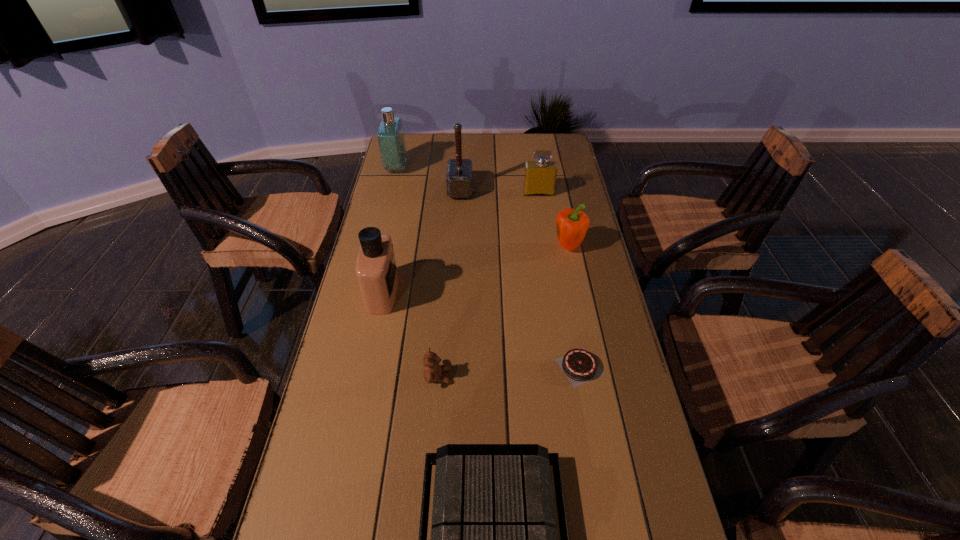
Find the location of `free space at the left edge of the desktop`. free space at the left edge of the desktop is located at coordinates (400, 172).

Where is `free spot at the right edge of the desktop`? Image resolution: width=960 pixels, height=540 pixels. free spot at the right edge of the desktop is located at coordinates (578, 175).

Locate an element on the screen. free space between the shortest object and the shortest perfume is located at coordinates (559, 280).

Locate an element on the screen. free area in between the fourth nearest object and the second nearest perfume is located at coordinates (461, 243).

Locate an element on the screen. vacant area that lies between the fifth nearest object and the shortest object is located at coordinates pyautogui.click(x=574, y=307).

At what (x,y) coordinates should I click in order to perform the action: click on vacant area that lies between the fourth nearest object and the shortest perfume. Please return your answer as a coordinate pair (x, y). The image size is (960, 540). Looking at the image, I should click on (461, 243).

Find the location of a particular element. Image resolution: width=960 pixels, height=540 pixels. free spot between the fourth farthest object and the fifth farthest object is located at coordinates (475, 270).

Locate an element on the screen. This screenshot has width=960, height=540. free point between the farthest object and the fifth farthest object is located at coordinates (390, 231).

This screenshot has width=960, height=540. I want to click on free space between the teddy bear and the second farthest perfume, so click(489, 285).

This screenshot has height=540, width=960. Identify the location of unoccupied area between the farthest object and the pepper. click(x=482, y=207).